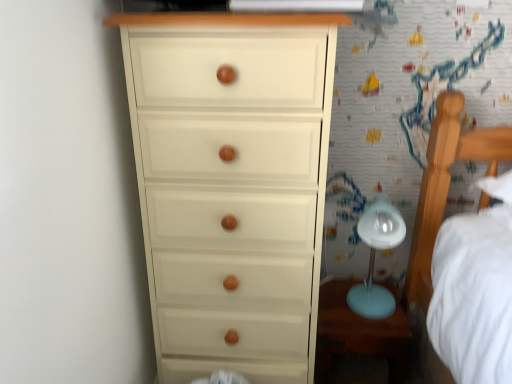
Question: From a real-world perspective, is matte white chest of drawers at left over matte blue table at lower right?

Choices:
 (A) yes
 (B) no

Answer: (A)

Question: From the image's perspective, is matte white chest of drawers at left on top of matte blue table at lower right?

Choices:
 (A) yes
 (B) no

Answer: (A)

Question: Is matte white chest of drawers at left not inside matte blue table at lower right?

Choices:
 (A) yes
 (B) no

Answer: (A)

Question: Is matte white chest of drawers at left oriented towards matte blue table at lower right?

Choices:
 (A) yes
 (B) no

Answer: (B)

Question: Does matte white chest of drawers at left have a lesser height compared to matte blue table at lower right?

Choices:
 (A) no
 (B) yes

Answer: (A)

Question: Is matte white chest of drawers at left thinner than matte blue table at lower right?

Choices:
 (A) no
 (B) yes

Answer: (A)

Question: Is light blue plastic table lamp at right far from matte white chest of drawers at left?

Choices:
 (A) yes
 (B) no

Answer: (B)

Question: Is light blue plastic table lamp at right to the left of matte white chest of drawers at left from the viewer's perspective?

Choices:
 (A) no
 (B) yes

Answer: (A)

Question: Is light blue plastic table lamp at right positioned with its back to matte white chest of drawers at left?

Choices:
 (A) no
 (B) yes

Answer: (A)

Question: From the image's perspective, would you say light blue plastic table lamp at right is shown under matte white chest of drawers at left?

Choices:
 (A) yes
 (B) no

Answer: (A)

Question: Does light blue plastic table lamp at right have a greater height compared to matte white chest of drawers at left?

Choices:
 (A) no
 (B) yes

Answer: (A)

Question: From a real-world perspective, does light blue plastic table lamp at right stand above matte white chest of drawers at left?

Choices:
 (A) yes
 (B) no

Answer: (B)

Question: Is matte blue table at lower right further to camera compared to light blue plastic table lamp at right?

Choices:
 (A) no
 (B) yes

Answer: (B)